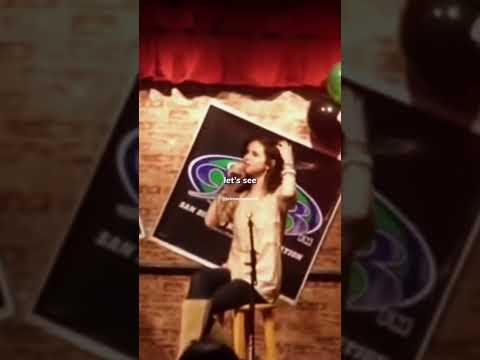
Where is `red drape`? The height and width of the screenshot is (360, 480). red drape is located at coordinates (274, 69).